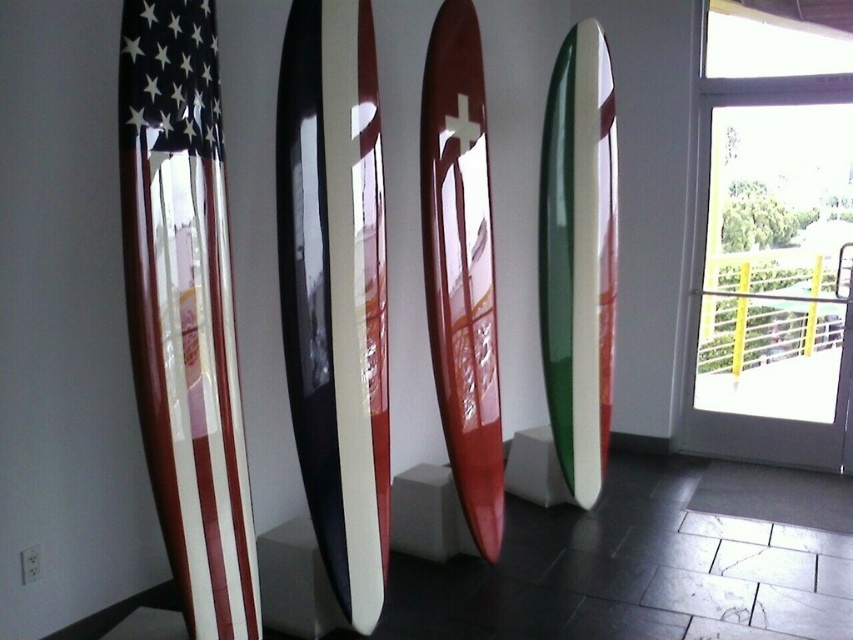
Can you confirm if shiny metallic flag at left is positioned above green glossy surfboard at center?

No, shiny metallic flag at left is not above green glossy surfboard at center.

Does point (257, 589) come farther from viewer compared to point (572, 198)?

No, (257, 589) is in front of (572, 198).

Which is behind, point (196, 461) or point (613, 93)?

The point (613, 93) is behind.

You are a GUI agent. You are given a task and a screenshot of the screen. Output one action in this format:
    pyautogui.click(x=<x>, y=<y>)
    Task: Click on the shiny metallic flag at left
    The height and width of the screenshot is (640, 853).
    Given the screenshot: What is the action you would take?
    pyautogui.click(x=184, y=308)

Between white glossy surfboard at center and shiny red surfboard at center, which one is positioned lower?

Positioned lower is white glossy surfboard at center.

Is point (351, 248) positioned after point (456, 323)?

No.

At what (x,y) coordinates should I click in order to perform the action: click on white glossy surfboard at center. Please return your answer as a coordinate pair (x, y). This screenshot has height=640, width=853. Looking at the image, I should click on (335, 291).

Describe the element at coordinates (184, 308) in the screenshot. I see `shiny metallic flag at left` at that location.

Does point (202, 637) lie in front of point (460, 260)?

Yes, point (202, 637) is in front of point (460, 260).

Locate an element on the screen. shiny metallic flag at left is located at coordinates (184, 308).